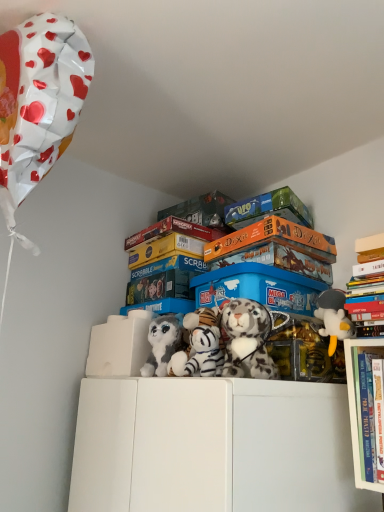
What do you see at coordinates (355, 405) in the screenshot? Image resolution: width=384 pixels, height=512 pixels. I see `hardcover books at upper right` at bounding box center [355, 405].

Image resolution: width=384 pixels, height=512 pixels. Describe the element at coordinates (333, 318) in the screenshot. I see `white plush duck at upper right, arranged as the 1th toy when viewed from the right` at that location.

In order to click on matt orange board game at upper center, acting as the first book starting from the left in this screenshot , I will do `click(172, 232)`.

Measure the distance between point (381, 238) and camera.

They are 38.23 inches apart.

The width and height of the screenshot is (384, 512). What do you see at coordinates (367, 287) in the screenshot? I see `hardcover books at right, which is the first book in right-to-left order` at bounding box center [367, 287].

The height and width of the screenshot is (512, 384). Find the location of `white plush tiger at center, the second toy viewed from the left`. white plush tiger at center, the second toy viewed from the left is located at coordinates (200, 346).

What do you see at coordinates (247, 340) in the screenshot? I see `white plush tiger at center, arranged as the 3th toy when viewed from the left` at bounding box center [247, 340].

Identify the location of white paper balloon at upper left. (38, 104).

Does white plush tiger at center, the second toy positioned from the right, have a larger size compared to white plush tiger at center, the third toy in the right-to-left sequence?

Yes.

Does white plush tiger at center, the second toy positioned from the right, appear on the right side of white plush tiger at center, the third toy in the right-to-left sequence?

Indeed, white plush tiger at center, the second toy positioned from the right, is positioned on the right side of white plush tiger at center, the third toy in the right-to-left sequence.

From a real-world perspective, which is physically above, white plush tiger at center, the second toy positioned from the right, or white plush tiger at center, the third toy in the right-to-left sequence?

white plush tiger at center, the second toy positioned from the right, from a real-world perspective.

Which is correct: white plush tiger at center, the second toy positioned from the right, is inside white plush tiger at center, the second toy viewed from the left, or outside of it?

white plush tiger at center, the second toy positioned from the right, cannot be found inside white plush tiger at center, the second toy viewed from the left.

Is hardcover books at right, which is the first book in right-to-left order, located within white plush tiger at center, arranged as the 3th toy when viewed from the left?

No, hardcover books at right, which is the first book in right-to-left order, is not a part of white plush tiger at center, arranged as the 3th toy when viewed from the left.

From a real-world perspective, is white plush tiger at center, arranged as the 3th toy when viewed from the left, above or below hardcover books at right, which is the first book in right-to-left order?

white plush tiger at center, arranged as the 3th toy when viewed from the left, is situated lower than hardcover books at right, which is the first book in right-to-left order, in the real world.

From a real-world perspective, count 1st books upward from the white plush tiger at center, the second toy positioned from the right, and point to it. Please provide its 2D coordinates.

[(367, 287)]

Looking at the image, does white plush tiger at center, the second toy positioned from the right, seem bigger or smaller compared to hardcover books at right, which is the first book in right-to-left order?

Clearly, white plush tiger at center, the second toy positioned from the right, is smaller in size than hardcover books at right, which is the first book in right-to-left order.

Is matt orange board game at upper center, acting as the first book starting from the left, positioned before white paper balloon at upper left?

No, matt orange board game at upper center, acting as the first book starting from the left, is further to the viewer.

From the image's perspective, does matt orange board game at upper center, placed as the third book when sorted from right to left, appear lower than white paper balloon at upper left?

Indeed, from the image's perspective, matt orange board game at upper center, placed as the third book when sorted from right to left, is shown beneath white paper balloon at upper left.

From a real-world perspective, is matt orange board game at upper center, placed as the third book when sorted from right to left, above or below white paper balloon at upper left?

From a real-world perspective, matt orange board game at upper center, placed as the third book when sorted from right to left, is physically below white paper balloon at upper left.

Who is taller, white paper balloon at upper left or hardcover books at right, which ranks as the third book in left-to-right order?

white paper balloon at upper left.

Between white paper balloon at upper left and hardcover books at right, which is the first book in right-to-left order, which one has smaller width?

With smaller width is hardcover books at right, which is the first book in right-to-left order.

Is hardcover books at right, which ranks as the third book in left-to-right order, completely or partially inside white paper balloon at upper left?

No.

Find the location of a particular element. Image resolution: width=384 pixels, height=512 pixels. the 1st book behind the white paper balloon at upper left, counting from the anchor's position is located at coordinates (367, 287).

Considering the points (326, 306) and (359, 462), which point is behind, point (326, 306) or point (359, 462)?

The point (326, 306) is more distant.

Is white plush duck at upper right, arranged as the 1th toy when viewed from the right, positioned with its back to hardcover books at upper right?

white plush duck at upper right, arranged as the 1th toy when viewed from the right, does not have its back to hardcover books at upper right.

Between white plush duck at upper right, which is counted as the 4th toy, starting from the left, and hardcover books at upper right, which one has more height?

Standing taller between the two is hardcover books at upper right.

Which point is more forward, (332, 263) or (330, 347)?

The point (330, 347) is more forward.

Is orange cardboard dixit board game at upper center, which is the 2th book from right to left, wider or thinner than white plush duck at upper right, arranged as the 1th toy when viewed from the right?

Considering their sizes, orange cardboard dixit board game at upper center, which is the 2th book from right to left, looks broader than white plush duck at upper right, arranged as the 1th toy when viewed from the right.

Consider the image. Is orange cardboard dixit board game at upper center, which is the 2th book in left-to-right order, spatially inside white plush duck at upper right, which is counted as the 4th toy, starting from the left, or outside of it?

orange cardboard dixit board game at upper center, which is the 2th book in left-to-right order, lies outside white plush duck at upper right, which is counted as the 4th toy, starting from the left.

Identify the location of toy that is the 1st object located below the orange cardboard dixit board game at upper center, which is the 2th book from right to left (from the image's perspective). (333, 318).

Considering the relative positions of white plush tiger at center, the second toy viewed from the left, and hardcover books at upper right in the image provided, is white plush tiger at center, the second toy viewed from the left, to the left or to the right of hardcover books at upper right?

Based on their positions, white plush tiger at center, the second toy viewed from the left, is located to the left of hardcover books at upper right.

Would you say white plush tiger at center, the third toy in the right-to-left sequence, contains hardcover books at upper right?

Actually, hardcover books at upper right is outside white plush tiger at center, the third toy in the right-to-left sequence.

Is white plush tiger at center, the third toy in the right-to-left sequence, facing towards hardcover books at upper right?

No, white plush tiger at center, the third toy in the right-to-left sequence, is not facing towards hardcover books at upper right.

Is white plush tiger at center, the third toy in the right-to-left sequence, far away from hardcover books at upper right?

No, white plush tiger at center, the third toy in the right-to-left sequence, is not far away from hardcover books at upper right.

Image resolution: width=384 pixels, height=512 pixels. I want to click on the 1st toy behind the white plush tiger at center, the second toy positioned from the right, counting from the anchor's position, so click(200, 346).

From a real-world perspective, count 2nd toys downward from the hardcover books at right, which is the first book in right-to-left order, and point to it. Please provide its 2D coordinates.

[(247, 340)]

Which object lies nearer to the anchor point white plush tiger at center, the second toy positioned from the right, blue plastic storage box at center or fluffy gray plush at center, the fourth toy when ordered from right to left?

The object closer to white plush tiger at center, the second toy positioned from the right, is blue plastic storage box at center.

Considering their positions, is hardcover books at upper right positioned further to matt orange board game at upper center, placed as the third book when sorted from right to left, than white plush duck at upper right, which is counted as the 4th toy, starting from the left?

hardcover books at upper right is further to matt orange board game at upper center, placed as the third book when sorted from right to left.

Considering their positions, is white plush tiger at center, the second toy positioned from the right, positioned further to blue plastic storage box at center than white plush tiger at center, the second toy viewed from the left?

white plush tiger at center, the second toy positioned from the right.

Looking at this image, when comparing their distances from hardcover books at upper right, does hardcover books at right, which is the first book in right-to-left order, or orange cardboard dixit board game at upper center, which is the 2th book from right to left, seem closer?

hardcover books at right, which is the first book in right-to-left order, is positioned closer to the anchor hardcover books at upper right.

Based on their spatial positions, is white plush tiger at center, the third toy in the right-to-left sequence, or hardcover books at right, which is the first book in right-to-left order, further from matt orange board game at upper center, acting as the first book starting from the left?

Based on the image, hardcover books at right, which is the first book in right-to-left order, appears to be further to matt orange board game at upper center, acting as the first book starting from the left.

Based on their spatial positions, is blue plastic storage box at center or white plush tiger at center, arranged as the 3th toy when viewed from the left, further from hardcover books at right, which ranks as the third book in left-to-right order?

white plush tiger at center, arranged as the 3th toy when viewed from the left, is positioned further to the anchor hardcover books at right, which ranks as the third book in left-to-right order.

Looking at the image, which one is located further to blue plastic storage box at center, hardcover books at right, which is the first book in right-to-left order, or white plush tiger at center, the third toy in the right-to-left sequence?

hardcover books at right, which is the first book in right-to-left order, is positioned further to the anchor blue plastic storage box at center.

Looking at the image, which one is located further to fluffy gray plush at center, the fourth toy when ordered from right to left, hardcover books at upper right or blue plastic storage box at center?

Based on the image, hardcover books at upper right appears to be further to fluffy gray plush at center, the fourth toy when ordered from right to left.

Find the location of a particular element. Image resolution: width=384 pixels, height=512 pixels. book between white plush tiger at center, arranged as the 3th toy when viewed from the left, and hardcover books at upper right is located at coordinates tap(273, 240).

This screenshot has width=384, height=512. Identify the location of toy located between white plush tiger at center, the third toy in the right-to-left sequence, and blue plastic storage box at center in the left-right direction. (247, 340).

Where is `storage box between hardcover books at right, which is the first book in right-to-left order, and orange cardboard dixit board game at upper center, which is the 2th book from right to left, from front to back`? storage box between hardcover books at right, which is the first book in right-to-left order, and orange cardboard dixit board game at upper center, which is the 2th book from right to left, from front to back is located at coordinates pos(258,288).

Find the location of a particular element. storage box between matt orange board game at upper center, placed as the third book when sorted from right to left, and white plush duck at upper right, which is counted as the 4th toy, starting from the left is located at coordinates (258, 288).